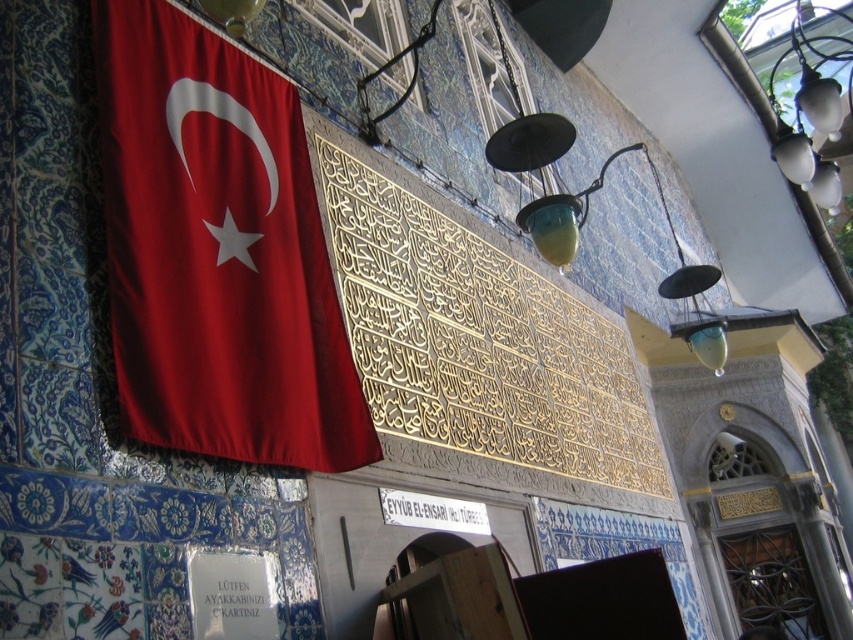
Who is more forward, [196,81] or [453,504]?

Point [196,81] is more forward.

Is velvet red flag at left in front of white metallic sign at center?

Yes, it is.

Is point (306, 273) farther from camera compared to point (485, 504)?

No, (306, 273) is in front of (485, 504).

Where is `velvet red flag at left`? The image size is (853, 640). velvet red flag at left is located at coordinates (218, 252).

Looking at this image, is translucent glass lamp at upper right below white paper sign at lower left?

Actually, translucent glass lamp at upper right is above white paper sign at lower left.

Which is behind, point (821, 122) or point (270, 611)?

Positioned behind is point (821, 122).

Locate an element on the screen. translucent glass lamp at upper right is located at coordinates (811, 116).

Can you confirm if translucent glass lamp at upper right is taller than white metallic sign at center?

Correct, translucent glass lamp at upper right is much taller as white metallic sign at center.

Can you confirm if translucent glass lamp at upper right is positioned above white metallic sign at center?

Yes.

Who is more forward, (830,189) or (465,516)?

Point (465,516) is more forward.

Identify the location of translucent glass lamp at upper right. The height and width of the screenshot is (640, 853). (811, 116).